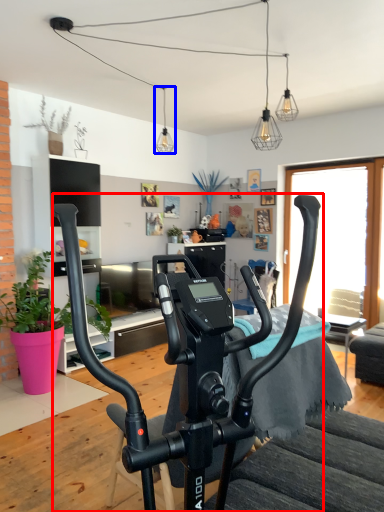
Question: Which point is further to the camera, stationary bicycle (highlighted by a red box) or light fixture (highlighted by a blue box)?

Choices:
 (A) stationary bicycle
 (B) light fixture

Answer: (B)